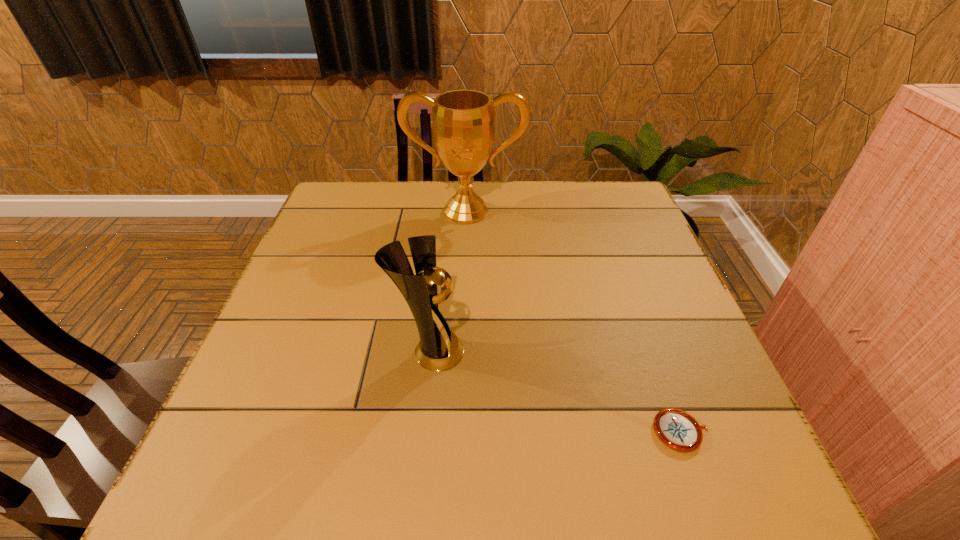
In order to click on unoccupied area between the rightmost object and the second tallest object in this screenshot , I will do `click(555, 392)`.

Locate an element on the screen. The image size is (960, 540). free space between the nearest object and the tallest object is located at coordinates (573, 321).

Identify which object is the second closest to the shortest object. Please provide its 2D coordinates. Your answer should be formatted as a tuple, i.e. [(x, y)], where the tuple contains the x and y coordinates of a point satisfying the conditions above.

[(463, 120)]

Image resolution: width=960 pixels, height=540 pixels. In order to click on object that is the second closest one to the shorter award in this screenshot , I will do `click(463, 120)`.

Where is `vacant space that satisfies the following two spatial constraints: 1. at the front of the second shortest object, where the globe is visible; 2. on the back side of the shortest object`? vacant space that satisfies the following two spatial constraints: 1. at the front of the second shortest object, where the globe is visible; 2. on the back side of the shortest object is located at coordinates (421, 431).

Where is `vacant region that satisfies the following two spatial constraints: 1. at the front of the nearest object, where the globe is visible; 2. on the left side of the shorter award`? vacant region that satisfies the following two spatial constraints: 1. at the front of the nearest object, where the globe is visible; 2. on the left side of the shorter award is located at coordinates (421, 431).

Identify the location of vacant space that satisfies the following two spatial constraints: 1. on the front-facing side of the farthest object; 2. at the front of the second tallest object, where the globe is visible. (460, 352).

What are the coordinates of `vacant space that satisfies the following two spatial constraints: 1. on the front-facing side of the farthest object; 2. on the left side of the compass` in the screenshot? It's located at (457, 431).

Find the location of a particular element. free spot that satisfies the following two spatial constraints: 1. at the front of the nearer award, where the globe is visible; 2. on the left side of the compass is located at coordinates (421, 431).

Where is `vacant position in the image that satisfies the following two spatial constraints: 1. at the front of the nearer award, where the globe is visible; 2. on the back side of the compass`? The image size is (960, 540). vacant position in the image that satisfies the following two spatial constraints: 1. at the front of the nearer award, where the globe is visible; 2. on the back side of the compass is located at coordinates (421, 431).